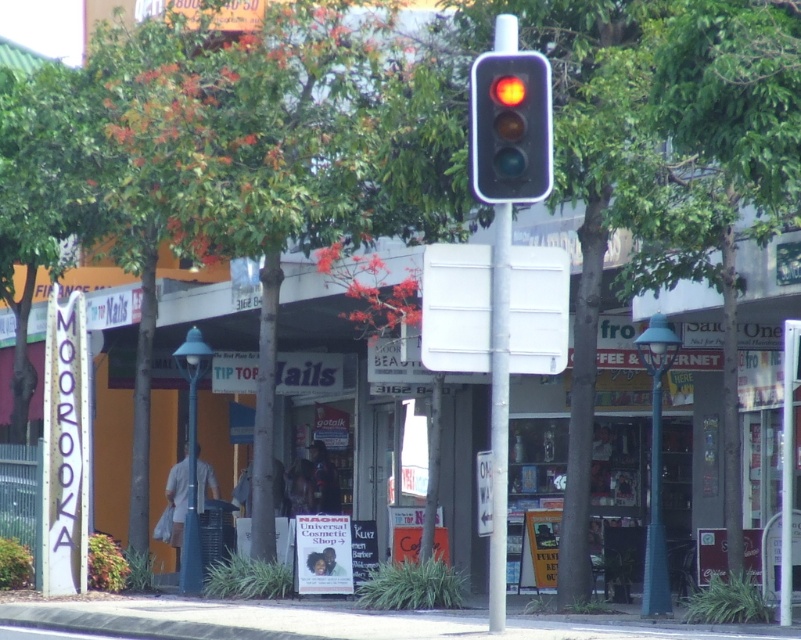
You are standing at the center of the street and see the point marked at coordinates (510, 128). What object is located at that point?

The point at coordinates (510, 128) corresponds to the matte glass traffic light at center.

You are a delivery driver who needs to ensure your vehicle can pass through the space between the matte glass traffic light at center and the metallic gray traffic light at center. The width of your vehicle is 2 meters. Can you safely navigate through the space between them?

The matte glass traffic light at center is smaller in size compared to the metallic gray traffic light at center, but the exact distance between them isn

You are standing in the street scene looking at the traffic light. There are two points marked on the image. Which point, point (510,170) or point (502,301), is closer to you?

Point (510,170) is closer to the camera than point (502,301).